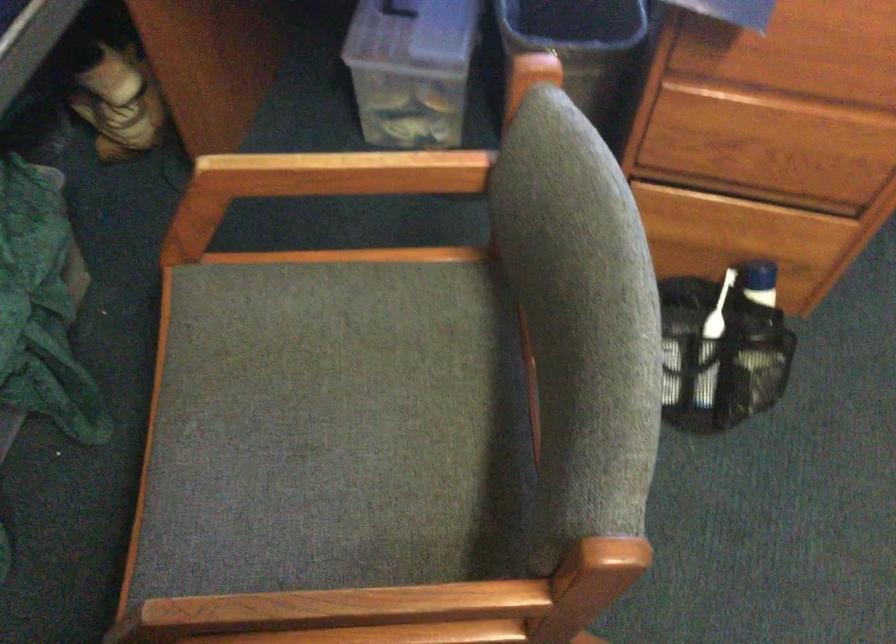
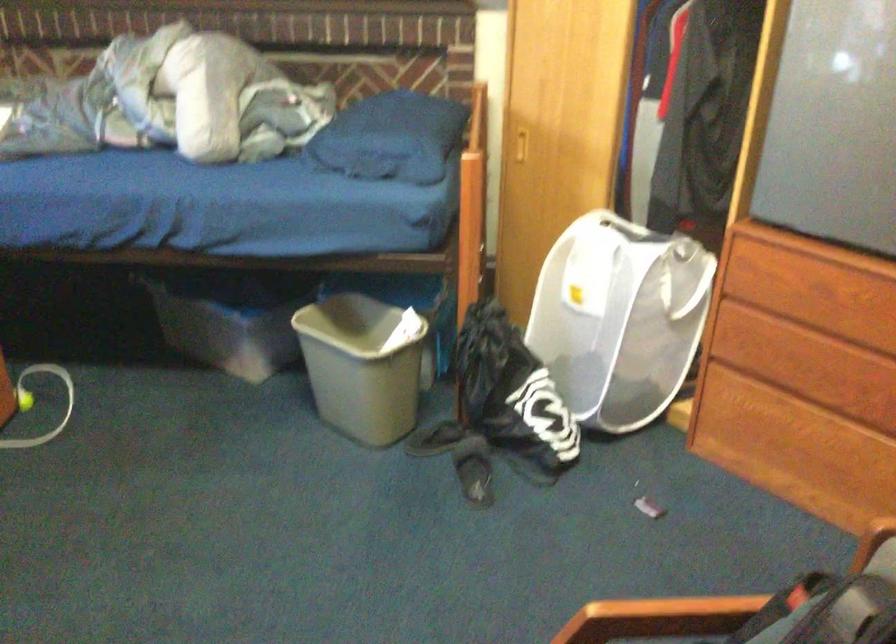
The first image is from the beginning of the video and the second image is from the end. How did the camera likely rotate when shooting the video?

The camera's rotation is toward right-down.